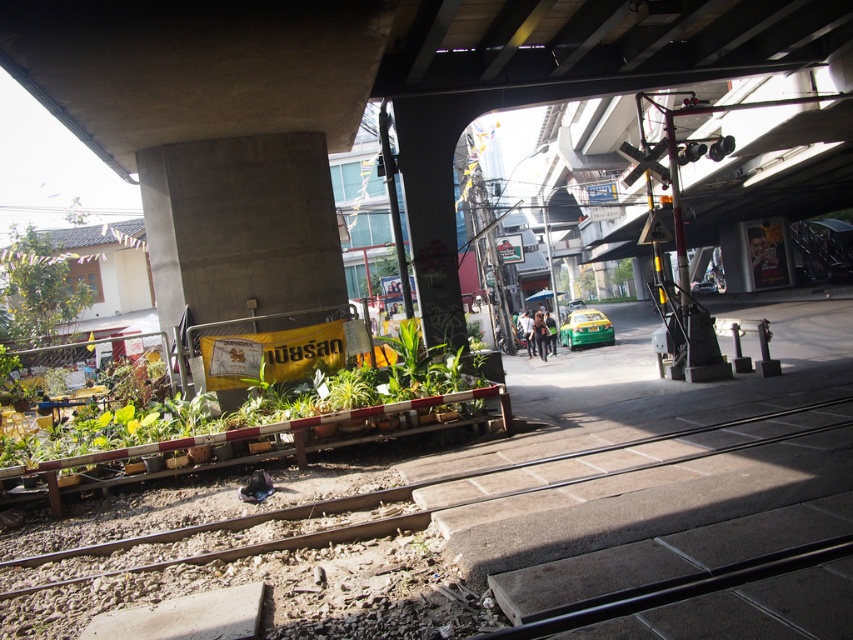
Question: Among these points, which one is nearest to the camera?

Choices:
 (A) (595, 337)
 (B) (712, 291)
 (C) (25, 269)

Answer: (C)

Question: Does brown wooden train track at lower left appear under green matte taxi at center?

Choices:
 (A) no
 (B) yes

Answer: (B)

Question: Can you confirm if green leafy plants at left is bigger than green matte taxi at center?

Choices:
 (A) no
 (B) yes

Answer: (A)

Question: Which is nearer to the green glossy taxi at center?

Choices:
 (A) green matte taxi at center
 (B) brown wooden train track at lower left

Answer: (A)

Question: Which point is farther from the camera taking this photo?

Choices:
 (A) (35, 467)
 (B) (44, 244)
 (C) (126, 122)
 (D) (712, 426)

Answer: (B)

Question: Is concrete at upper center thinner than brown wooden train track at lower left?

Choices:
 (A) no
 (B) yes

Answer: (A)